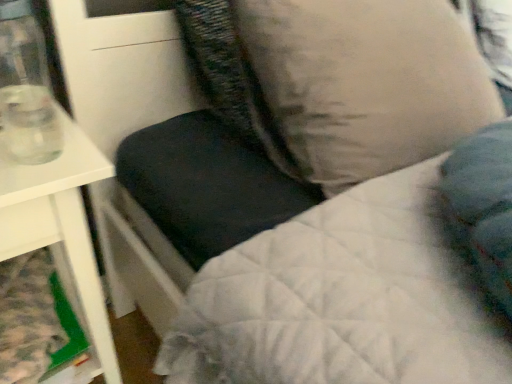
Describe the element at coordinates (362, 84) in the screenshot. I see `beige fabric pillow at upper right` at that location.

I want to click on white glossy table at left, so click(x=60, y=223).

Where is `transparent glass at left`? transparent glass at left is located at coordinates (26, 88).

Is point (63, 123) behind point (32, 84)?

No, it is in front of (32, 84).

Where is `glass vase in front of the white glossy table at left`? glass vase in front of the white glossy table at left is located at coordinates (26, 88).

Is white glossy table at left touching transparent glass at left?

No, white glossy table at left is not beside transparent glass at left.

Image resolution: width=512 pixels, height=384 pixels. I want to click on pillow below the transparent glass at left (from a real-world perspective), so click(x=362, y=84).

Consider the image. Is transparent glass at left to the left of beige fabric pillow at upper right from the viewer's perspective?

Answer: Correct, you'll find transparent glass at left to the left of beige fabric pillow at upper right.

Is transparent glass at left inside or outside of beige fabric pillow at upper right?

transparent glass at left is located beyond the bounds of beige fabric pillow at upper right.

Which of these two, transparent glass at left or beige fabric pillow at upper right, is bigger?

beige fabric pillow at upper right is bigger.

Is beige fabric pillow at upper right with white glossy table at left?

No, beige fabric pillow at upper right is not in contact with white glossy table at left.

Is point (405, 152) more distant than point (81, 185)?

Yes, it is behind point (81, 185).

From the image's perspective, would you say beige fabric pillow at upper right is positioned over white glossy table at left?

Indeed, from the image's perspective, beige fabric pillow at upper right is shown above white glossy table at left.

Are transparent glass at left and white glossy table at left beside each other?

No, transparent glass at left is not touching white glossy table at left.

Is transparent glass at left taller or shorter than white glossy table at left?

Clearly, transparent glass at left is shorter compared to white glossy table at left.

From the image's perspective, is transparent glass at left on top of white glossy table at left?

Yes, from the image's perspective, transparent glass at left is over white glossy table at left.

Looking at this image, which object is positioned more to the right, transparent glass at left or white glossy table at left?

transparent glass at left.

Can you confirm if beige fabric pillow at upper right is shorter than transparent glass at left?

Incorrect, the height of beige fabric pillow at upper right does not fall short of that of transparent glass at left.

Is beige fabric pillow at upper right smaller than transparent glass at left?

Actually, beige fabric pillow at upper right might be larger than transparent glass at left.

Between beige fabric pillow at upper right and transparent glass at left, which one has larger width?

beige fabric pillow at upper right.

From the image's perspective, which one is positioned lower, beige fabric pillow at upper right or transparent glass at left?

transparent glass at left appears lower in the image.

From the picture: Who is taller, white glossy table at left or beige fabric pillow at upper right?

With more height is white glossy table at left.

Is white glossy table at left smaller than beige fabric pillow at upper right?

No.

Identify the location of table below the beige fabric pillow at upper right (from the image's perspective). This screenshot has height=384, width=512. (60, 223).

From the image's perspective, which is above, white glossy table at left or beige fabric pillow at upper right?

From the image's view, beige fabric pillow at upper right is above.

You are a GUI agent. You are given a task and a screenshot of the screen. Output one action in this format:
    pyautogui.click(x=<x>, y=<y>)
    Task: Click on the glass vase located above the white glossy table at left (from the image's perspective)
    The image size is (512, 384).
    Given the screenshot: What is the action you would take?
    pyautogui.click(x=26, y=88)

Where is `glass vase that is below the beige fabric pillow at upper right (from the image's perspective)`? glass vase that is below the beige fabric pillow at upper right (from the image's perspective) is located at coordinates (26, 88).

When comparing their distances from beige fabric pillow at upper right, does transparent glass at left or white glossy table at left seem further?

Among the two, transparent glass at left is located further to beige fabric pillow at upper right.

Based on their spatial positions, is white glossy table at left or beige fabric pillow at upper right closer to transparent glass at left?

The object closer to transparent glass at left is white glossy table at left.

When comparing their distances from beige fabric pillow at upper right, does white glossy table at left or transparent glass at left seem further?

transparent glass at left is positioned further to the anchor beige fabric pillow at upper right.

Looking at the image, which one is located closer to transparent glass at left, beige fabric pillow at upper right or white glossy table at left?

white glossy table at left.

When comparing their distances from white glossy table at left, does transparent glass at left or beige fabric pillow at upper right seem further?

Based on the image, beige fabric pillow at upper right appears to be further to white glossy table at left.

Which object lies nearer to the anchor point white glossy table at left, beige fabric pillow at upper right or transparent glass at left?

The object closer to white glossy table at left is transparent glass at left.

The image size is (512, 384). Find the location of `glass vase between white glossy table at left and beige fabric pillow at upper right`. glass vase between white glossy table at left and beige fabric pillow at upper right is located at coordinates (26, 88).